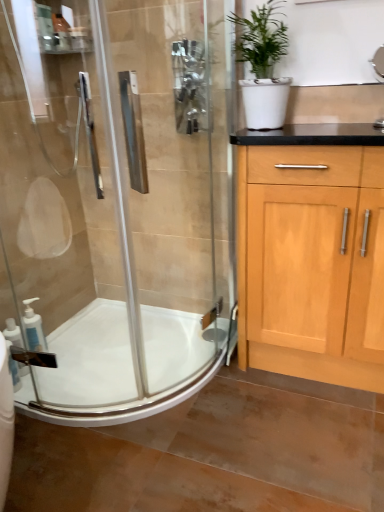
Find the location of a particular element. Image resolution: width=384 pixels, height=512 pixels. unoccupied area in front of clear glass shower door at left is located at coordinates (63, 461).